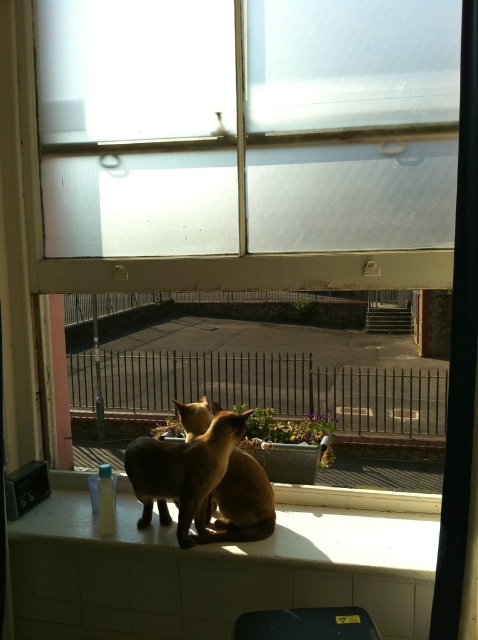
Is satin brown cat at center thinner than golden fur cat at center?

Incorrect, satin brown cat at center's width is not less than golden fur cat at center's.

Between satin brown cat at center and golden fur cat at center, which one is positioned higher?

golden fur cat at center is higher up.

In order to click on satin brown cat at center in this screenshot , I will do `click(348, 531)`.

The height and width of the screenshot is (640, 478). In order to click on satin brown cat at center in this screenshot , I will do `click(348, 531)`.